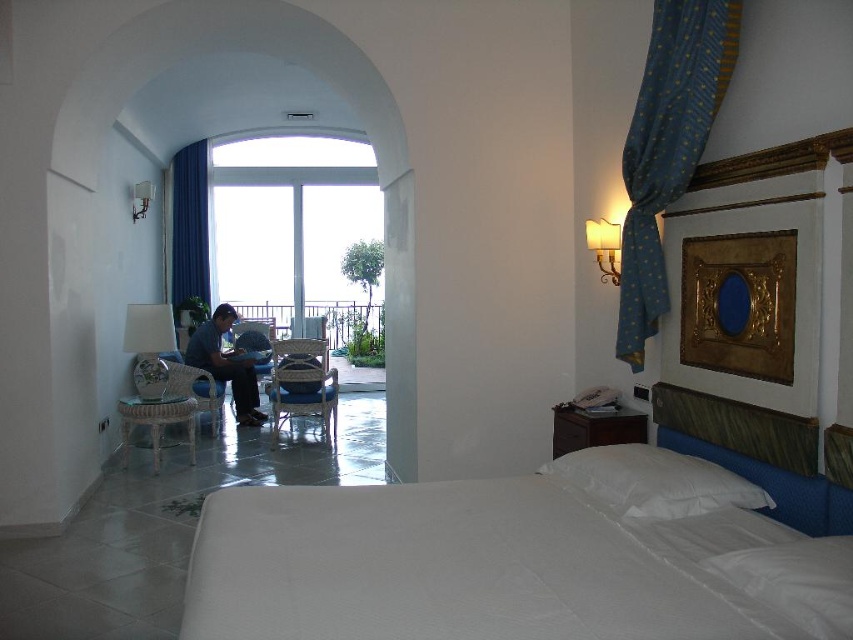
You are a delivery person who needs to place a package between the blue textured fabric at upper right and the rattan wicker stool at lower left. The package is 3 meters long. Can you fit it there without bending the package?

The distance between the blue textured fabric at upper right and the rattan wicker stool at lower left is 3.66 meters, so yes, the package can be placed there as it is shorter than the available space.

Looking at this image, you are a guest in this room and want to place a small decorative item on the blue textured fabric at upper right and the wicker armchair at center. Which surface is higher in elevation?

The blue textured fabric at upper right is located above the wicker armchair at center, so it is higher in elevation.

You are standing in the hotel room and want to locate the blue textured fabric at upper right. According to the room layout, where exactly is it positioned in relation to the other elements?

The blue textured fabric at upper right is positioned at coordinates point [666,147], which places it near the upper right corner of the room, possibly near the arched balcony opening or the ceiling area.